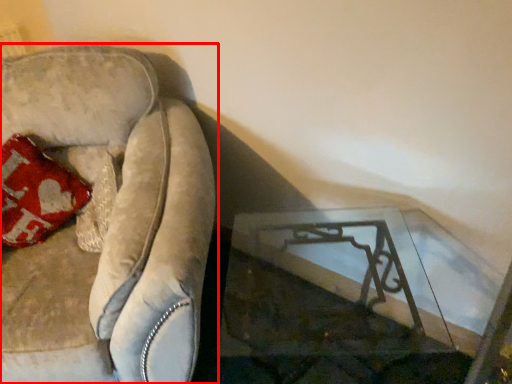
Question: In this image, where is furniture (annotated by the red box) located relative to table?

Choices:
 (A) right
 (B) left

Answer: (B)